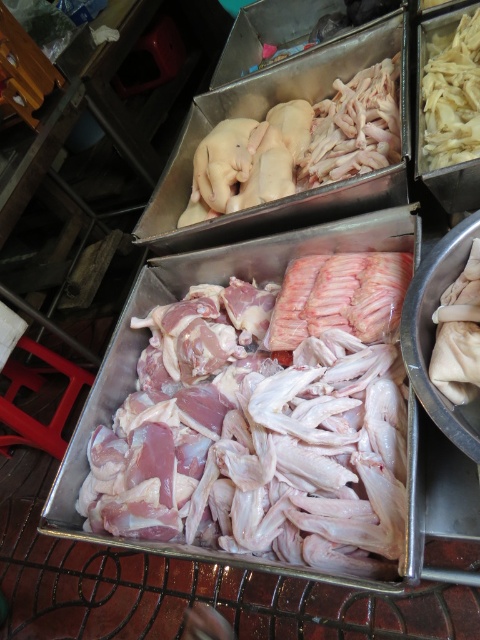
Is pink raw meat at center below pale pink raw meat at upper center?

Yes, pink raw meat at center is below pale pink raw meat at upper center.

From the picture: Between pink raw meat at center and pale pink raw meat at upper center, which one appears on the left side from the viewer's perspective?

Positioned to the left is pink raw meat at center.

This screenshot has width=480, height=640. Describe the element at coordinates (255, 442) in the screenshot. I see `pink raw meat at center` at that location.

Identify the location of pink raw meat at center. This screenshot has height=640, width=480. (255, 442).

Is pink raw meat at center in front of white matte noodles at upper right?

Yes, it is.

Based on the photo, is pink raw meat at center to the right of white matte noodles at upper right from the viewer's perspective?

In fact, pink raw meat at center is to the left of white matte noodles at upper right.

Locate an element on the screen. This screenshot has height=640, width=480. pink raw meat at center is located at coordinates (255, 442).

Find the location of a particular element. The height and width of the screenshot is (640, 480). pink raw meat at center is located at coordinates coord(255,442).

Is pale pink raw meat at upper center positioned at the back of white matte noodles at upper right?

Yes, it is.

Between point (389, 157) and point (443, 84), which one is positioned in front?

Point (443, 84)

In order to click on pale pink raw meat at upper center in this screenshot , I will do `click(299, 145)`.